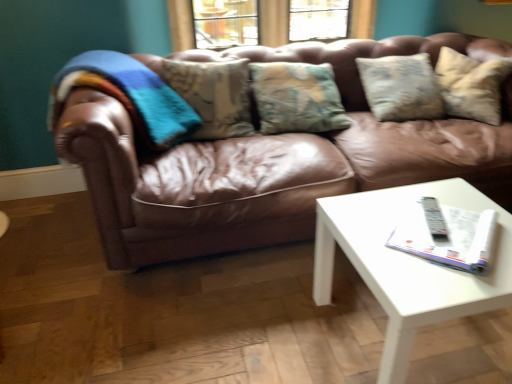
I want to click on brown leather couch at center, so 272,161.

Where is `white glossy coffee table at lower right`? This screenshot has width=512, height=384. white glossy coffee table at lower right is located at coordinates (408, 264).

The image size is (512, 384). Describe the element at coordinates (408, 264) in the screenshot. I see `white glossy coffee table at lower right` at that location.

I want to click on brown leather couch at center, so click(x=272, y=161).

Between white glossy coffee table at lower right and white glossy magazine at center right, which one appears on the right side from the viewer's perspective?

Positioned to the right is white glossy magazine at center right.

Considering the positions of points (389, 260) and (487, 234), is point (389, 260) closer to camera compared to point (487, 234)?

Yes, point (389, 260) is closer to viewer.

Between white glossy coffee table at lower right and white glossy magazine at center right, which one has less height?

With less height is white glossy magazine at center right.

Is brown leather couch at center completely or partially outside of white glossy coffee table at lower right?

brown leather couch at center lies outside white glossy coffee table at lower right's area.

Is the surface of brown leather couch at center in direct contact with white glossy coffee table at lower right?

No, brown leather couch at center is not beside white glossy coffee table at lower right.

Can you confirm if brown leather couch at center is taller than white glossy coffee table at lower right?

Yes.

Is brown leather couch at center bigger than white glossy coffee table at lower right?

Correct, brown leather couch at center is larger in size than white glossy coffee table at lower right.

Which object is further away from the camera taking this photo, white glossy coffee table at lower right or brown leather couch at center?

brown leather couch at center is further away from the camera.

From the image's perspective, is white glossy coffee table at lower right positioned above or below brown leather couch at center?

Clearly, from the image's perspective, white glossy coffee table at lower right is below brown leather couch at center.

Looking at their sizes, would you say white glossy coffee table at lower right is wider or thinner than brown leather couch at center?

Considering their sizes, white glossy coffee table at lower right looks slimmer than brown leather couch at center.

Considering the positions of point (382, 232) and point (340, 181), is point (382, 232) closer or farther from the camera than point (340, 181)?

Point (382, 232) is closer to the camera than point (340, 181).

From a real-world perspective, is brown leather couch at center positioned above or below white glossy magazine at center right?

brown leather couch at center is situated lower than white glossy magazine at center right in the real world.

Is brown leather couch at center not near white glossy magazine at center right?

That's not correct — brown leather couch at center is a little close to white glossy magazine at center right.

Considering the sizes of objects brown leather couch at center and white glossy magazine at center right in the image provided, who is smaller, brown leather couch at center or white glossy magazine at center right?

Smaller between the two is white glossy magazine at center right.

Does white glossy magazine at center right have a greater width compared to brown leather couch at center?

Incorrect, the width of white glossy magazine at center right does not surpass that of brown leather couch at center.

There is a brown leather couch at center. Identify the location of magazine above it (from a real-world perspective). (446, 235).

From the image's perspective, is white glossy magazine at center right on brown leather couch at center?

No, from the image's perspective, white glossy magazine at center right is not over brown leather couch at center.

Which of these two, white glossy magazine at center right or brown leather couch at center, is smaller?

Smaller between the two is white glossy magazine at center right.

Would you say white glossy magazine at center right is a long distance from white glossy coffee table at lower right?

No, there isn't a large distance between white glossy magazine at center right and white glossy coffee table at lower right.

Is white glossy magazine at center right further to the viewer compared to white glossy coffee table at lower right?

Yes, it is behind white glossy coffee table at lower right.

From a real-world perspective, which object rests below the other?

In real-world perspective, white glossy coffee table at lower right is lower.

Measure the distance between white glossy magazine at center right and white glossy coffee table at lower right.

white glossy magazine at center right and white glossy coffee table at lower right are 4.44 inches apart.

At what (x,y) coordinates should I click in order to perform the action: click on coffee table below the white glossy magazine at center right (from the image's perspective). Please return your answer as a coordinate pair (x, y). This screenshot has height=384, width=512. Looking at the image, I should click on (408, 264).

This screenshot has height=384, width=512. Identify the location of coffee table beneath the brown leather couch at center (from a real-world perspective). pyautogui.click(x=408, y=264).

When comparing their distances from white glossy magazine at center right, does white glossy coffee table at lower right or brown leather couch at center seem closer?

white glossy coffee table at lower right.

When comparing their distances from brown leather couch at center, does white glossy coffee table at lower right or white glossy magazine at center right seem closer?

white glossy coffee table at lower right lies closer to brown leather couch at center than the other object.

Considering their positions, is brown leather couch at center positioned closer to white glossy magazine at center right than white glossy coffee table at lower right?

white glossy coffee table at lower right lies closer to white glossy magazine at center right than the other object.

Based on their spatial positions, is white glossy magazine at center right or white glossy coffee table at lower right further from brown leather couch at center?

Based on the image, white glossy magazine at center right appears to be further to brown leather couch at center.

Which object lies further to the anchor point white glossy coffee table at lower right, white glossy magazine at center right or brown leather couch at center?

brown leather couch at center lies further to white glossy coffee table at lower right than the other object.

Estimate the real-world distances between objects in this image. Which object is further from white glossy coffee table at lower right, brown leather couch at center or white glossy magazine at center right?

Among the two, brown leather couch at center is located further to white glossy coffee table at lower right.

Locate an element on the screen. Image resolution: width=512 pixels, height=384 pixels. magazine that lies between brown leather couch at center and white glossy coffee table at lower right from top to bottom is located at coordinates (446, 235).